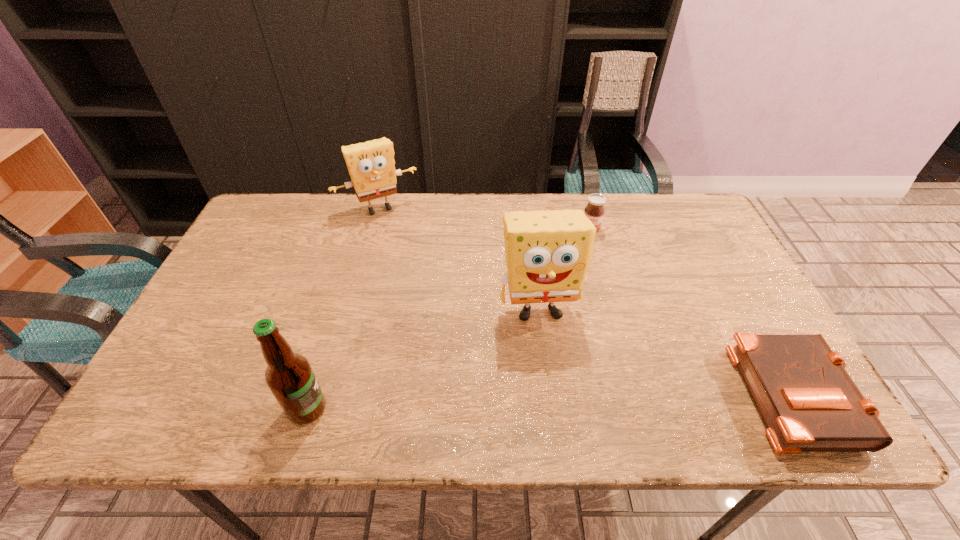
Identify the location of beer bottle located at the near edge. The width and height of the screenshot is (960, 540). (289, 376).

You are a GUI agent. You are given a task and a screenshot of the screen. Output one action in this format:
    pyautogui.click(x=<x>, y=<y>)
    Task: Click on the Bible at the near edge
    Image resolution: width=960 pixels, height=540 pixels.
    Given the screenshot: What is the action you would take?
    pyautogui.click(x=809, y=403)

Find the location of a particular element. object at the right edge is located at coordinates (809, 403).

You are a GUI agent. You are given a task and a screenshot of the screen. Output one action in this format:
    pyautogui.click(x=<x>, y=<y>)
    Task: Click on the object that is at the near right corner
    The width and height of the screenshot is (960, 540).
    Given the screenshot: What is the action you would take?
    [x=809, y=403]

Identify the location of free spot at the far edge of the desktop. This screenshot has width=960, height=540. (617, 225).

You are a GUI agent. You are given a task and a screenshot of the screen. Output one action in this format:
    pyautogui.click(x=<x>, y=<y>)
    Task: Click on the free spot at the left edge of the desktop
    Image resolution: width=960 pixels, height=540 pixels.
    Given the screenshot: What is the action you would take?
    pyautogui.click(x=265, y=289)

You are a GUI agent. You are given a task and a screenshot of the screen. Output one action in this format:
    pyautogui.click(x=<x>, y=<y>)
    Task: Click on the vacant position at the right edge of the desktop
    
    Given the screenshot: What is the action you would take?
    pyautogui.click(x=700, y=294)

In the image, there is a desktop. In order to click on vacant region at the far left corner in this screenshot , I will do `click(297, 195)`.

In the image, there is a desktop. Find the location of `vacant space at the far right corner`. vacant space at the far right corner is located at coordinates (696, 215).

In order to click on vacant space in between the left sponge and the beer bottle in this screenshot , I will do `click(344, 308)`.